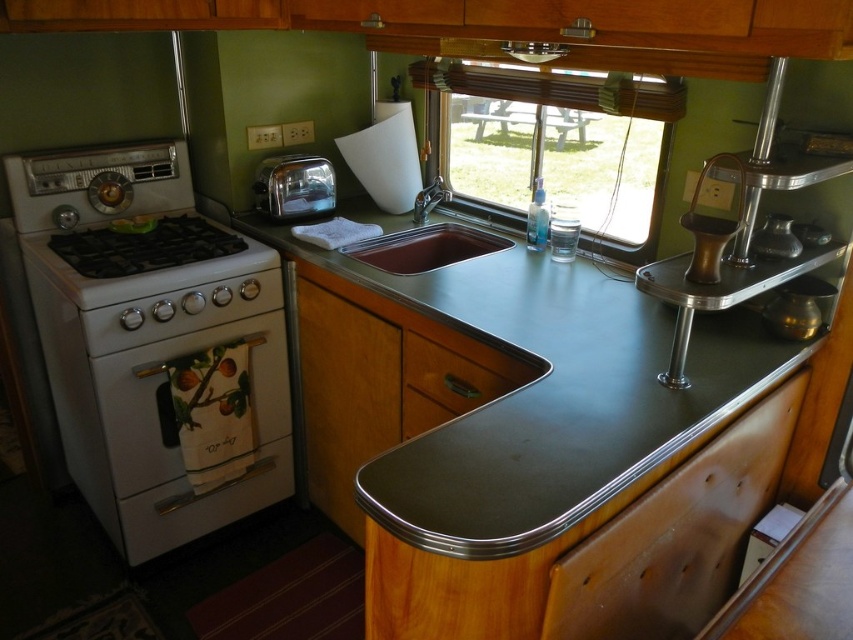
Question: Can you confirm if white glossy stove at left is smaller than wooden drawer at lower left?

Choices:
 (A) yes
 (B) no

Answer: (B)

Question: Can you confirm if white glossy gas stove at left is positioned to the left of stainless steel sink at center?

Choices:
 (A) no
 (B) yes

Answer: (B)

Question: Which point appears closest to the camera in this image?

Choices:
 (A) (83, 246)
 (B) (212, 520)
 (C) (97, 179)

Answer: (A)

Question: Does wooden drawer at lower left appear over polished chrome toaster at center?

Choices:
 (A) no
 (B) yes

Answer: (A)

Question: Among these objects, which one is nearest to the camera?

Choices:
 (A) polished chrome toaster at center
 (B) wooden drawer at lower center
 (C) white glossy stove at left
 (D) metallic gray countertop at center

Answer: (D)

Question: Which point appears farthest from the camera in this image?

Choices:
 (A) (74, 397)
 (B) (316, 168)
 (C) (61, 248)

Answer: (B)